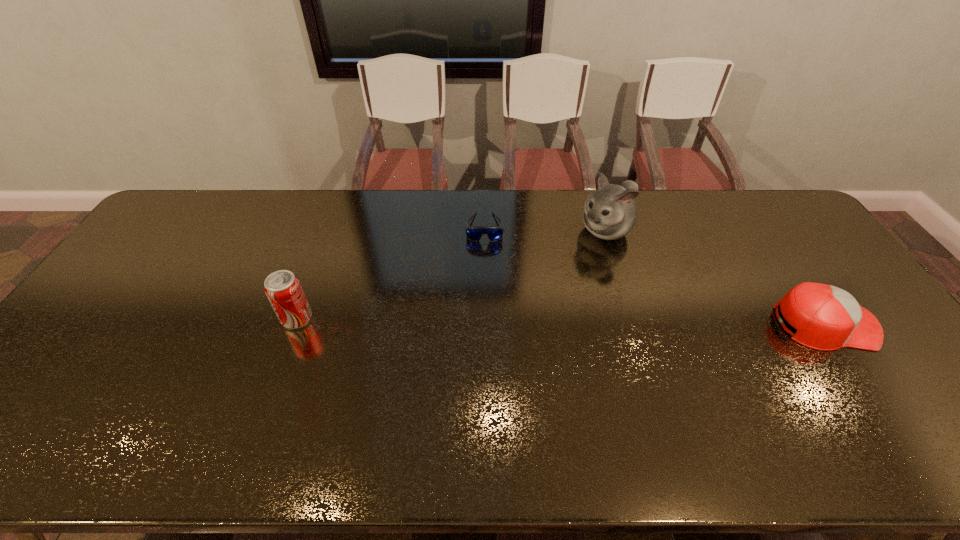
At what (x,y) coordinates should I click in order to perform the action: click on unoccupied position between the third shortest object and the second shortest object. Please return your answer as a coordinate pair (x, y). This screenshot has height=540, width=960. Looking at the image, I should click on (561, 321).

Identify the location of free space that is in between the soda can and the sunglasses. (391, 273).

Identify the location of the closest object to the baseball cap. This screenshot has height=540, width=960. (610, 213).

Identify the location of object that is the closest to the shortest object. (610, 213).

Locate an element on the screen. vacant space that satisfies the following two spatial constraints: 1. on the front side of the second shortest object; 2. on the front-facing side of the hamster is located at coordinates (635, 323).

Where is `vacant region that satisfies the following two spatial constraints: 1. on the front side of the rightmost object; 2. on the front-facing side of the sunglasses`? This screenshot has width=960, height=540. vacant region that satisfies the following two spatial constraints: 1. on the front side of the rightmost object; 2. on the front-facing side of the sunglasses is located at coordinates (486, 323).

Find the location of a particular element. The width and height of the screenshot is (960, 540). free space in the image that satisfies the following two spatial constraints: 1. on the front side of the second shortest object; 2. on the front-facing side of the second object from right to left is located at coordinates (635, 323).

This screenshot has width=960, height=540. What are the coordinates of `vacant space that satisfies the following two spatial constraints: 1. on the front side of the sunglasses; 2. on the front-facing side of the third tallest object` in the screenshot? It's located at (486, 323).

Image resolution: width=960 pixels, height=540 pixels. I want to click on vacant point that satisfies the following two spatial constraints: 1. on the front side of the third shortest object; 2. on the front-facing side of the rightmost object, so click(295, 323).

The image size is (960, 540). Find the location of `vacant space that satisfies the following two spatial constraints: 1. on the front side of the third object from left to right; 2. on the front-facing side of the second shortest object`. vacant space that satisfies the following two spatial constraints: 1. on the front side of the third object from left to right; 2. on the front-facing side of the second shortest object is located at coordinates (635, 323).